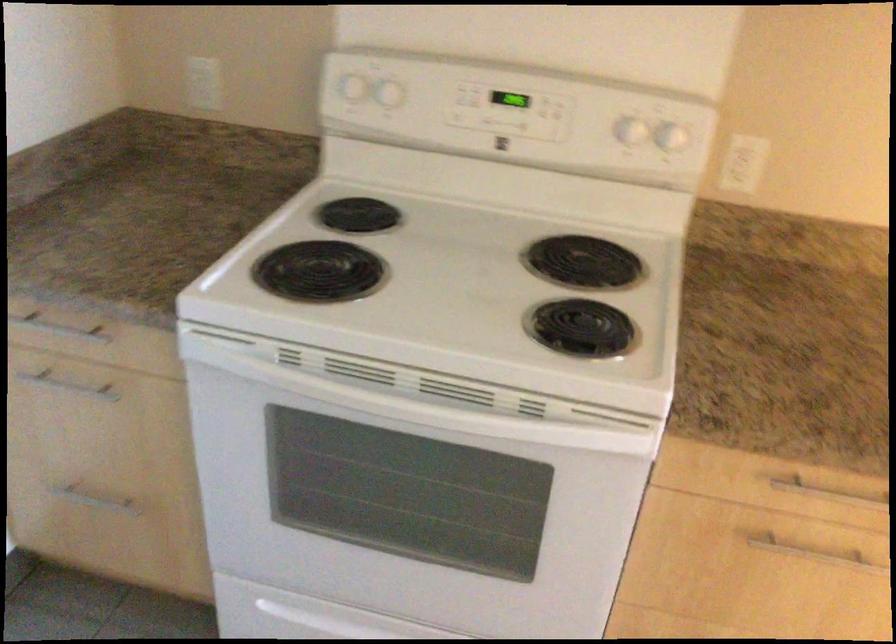
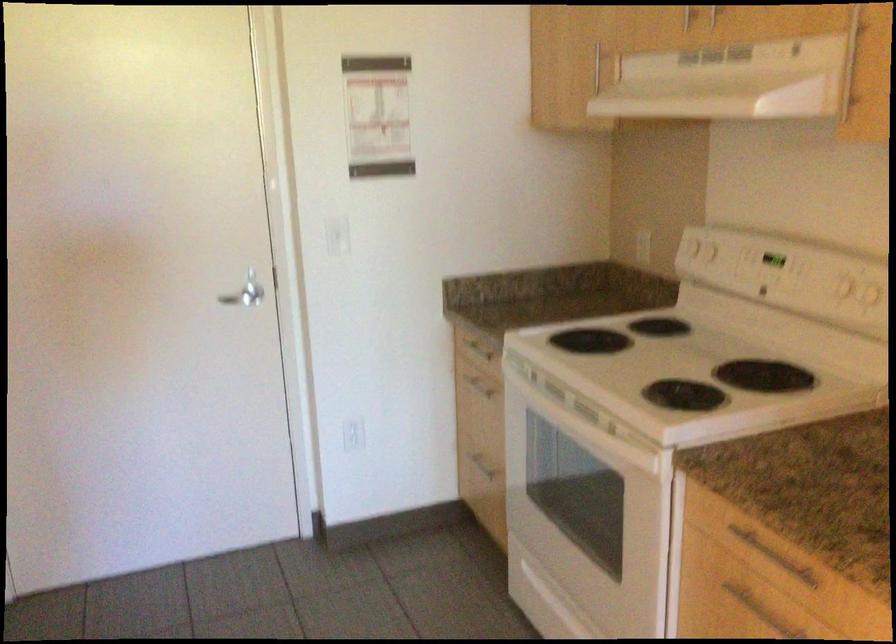
Find the pixel in the second image that matches the point at 87,389 in the first image.

(479, 384)